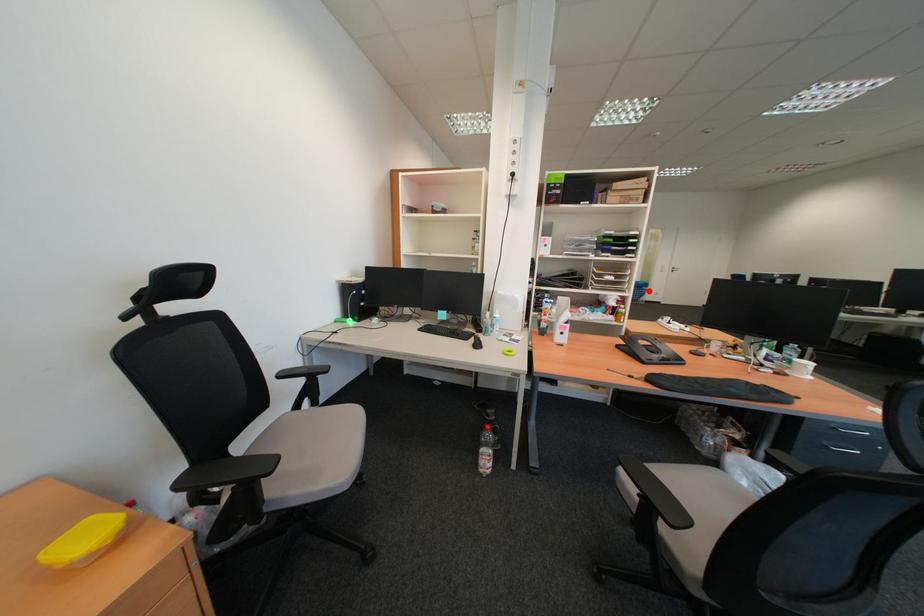
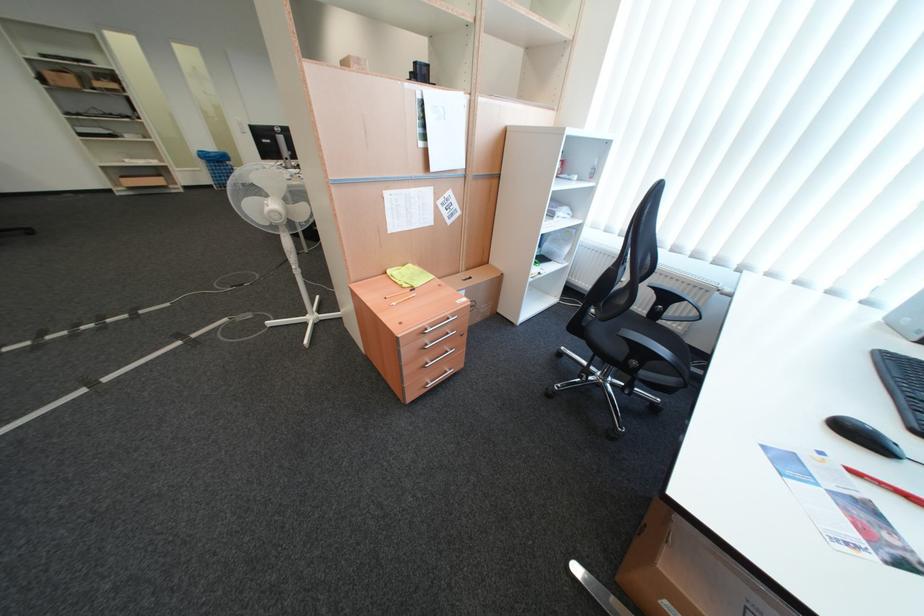
Question: I am providing you with two images of the same scene from different viewpoints. A red point is shown in image1. For the corresponding object point in image2, is it positioned nearer or farther from the camera?

Choices:
 (A) Nearer
 (B) Farther

Answer: (A)